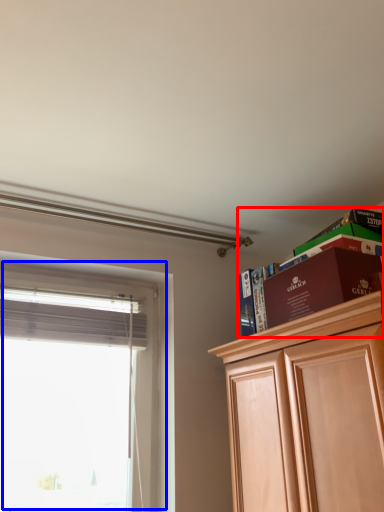
Question: Among these objects, which one is nearest to the camera, shelf (highlighted by a red box) or window (highlighted by a blue box)?

Choices:
 (A) shelf
 (B) window

Answer: (A)